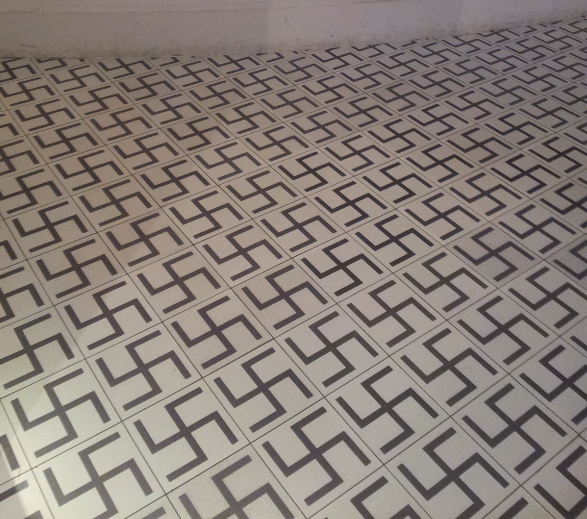
Find the location of `tile`. tile is located at coordinates (517, 58).